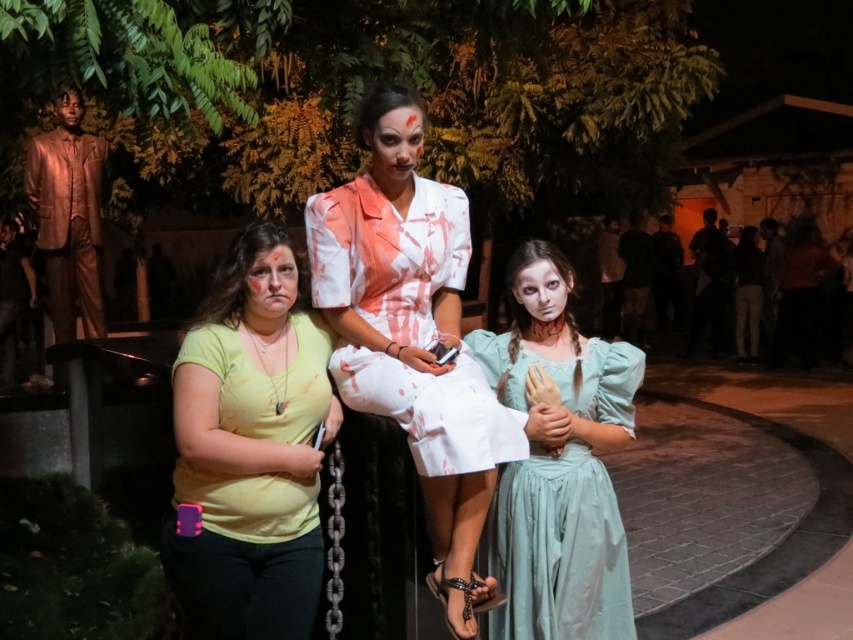
You are standing in the night scene with two points marked in the image. Which point, point (474,592) or point (584,525), is nearer to you?

Point (474,592) is closer to the viewer than point (584,525).